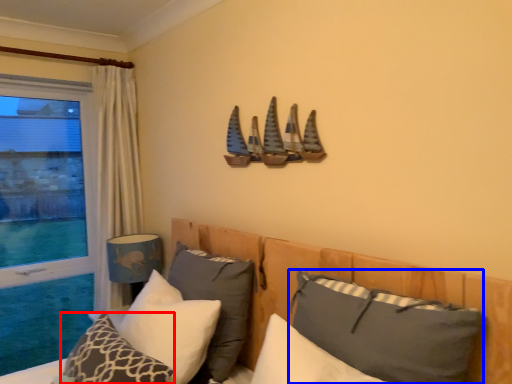
Question: Which object is closer to the camera taking this photo, pillow (highlighted by a red box) or pillow (highlighted by a blue box)?

Choices:
 (A) pillow
 (B) pillow

Answer: (B)